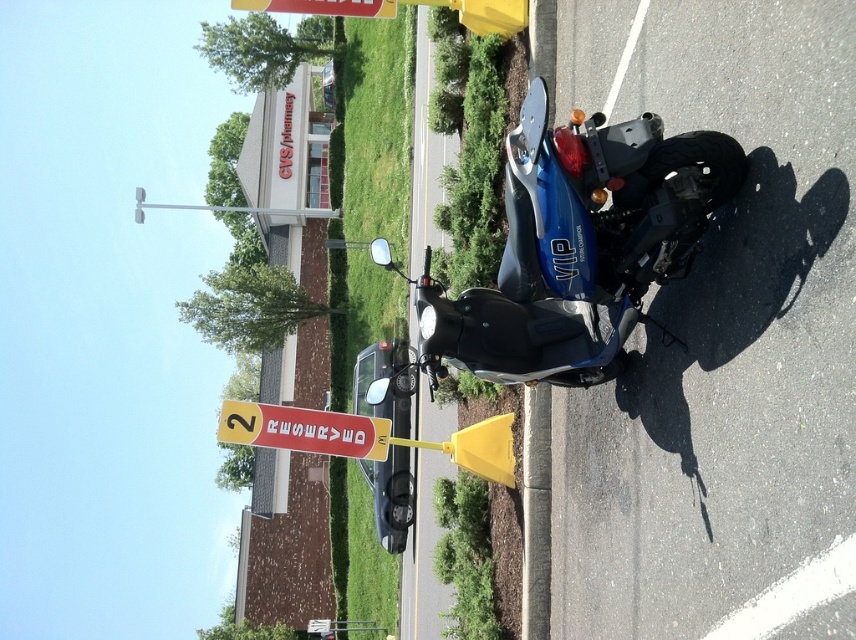
Question: Is blue glossy scooter at center above red plastic sign at lower center?

Choices:
 (A) no
 (B) yes

Answer: (B)

Question: Can you confirm if blue glossy scooter at center is positioned to the right of red plastic sign at lower center?

Choices:
 (A) no
 (B) yes

Answer: (B)

Question: Is blue glossy scooter at center closer to the viewer compared to red plastic sign at lower center?

Choices:
 (A) yes
 (B) no

Answer: (A)